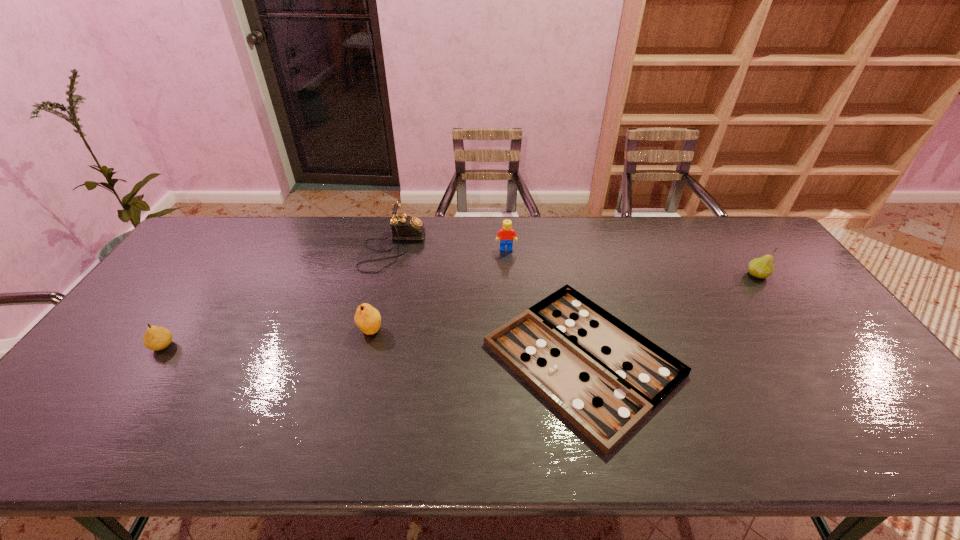
What are the coordinates of `telephone` in the screenshot? It's located at (404, 227).

Find the location of `Lego`. Lego is located at coordinates coord(506,234).

The image size is (960, 540). Identify the location of the rightmost pear. (763, 267).

The image size is (960, 540). What are the coordinates of `the farthest pear` in the screenshot? It's located at (763, 267).

The height and width of the screenshot is (540, 960). In order to click on the second pear from left to right in this screenshot , I will do `click(367, 318)`.

Where is `the leftmost pear`? This screenshot has width=960, height=540. the leftmost pear is located at coordinates (156, 338).

You are a GUI agent. You are given a task and a screenshot of the screen. Output one action in this format:
    pyautogui.click(x=<x>, y=<y>)
    Task: Click on the gameboard
    Image resolution: width=960 pixels, height=540 pixels.
    Given the screenshot: What is the action you would take?
    pyautogui.click(x=604, y=377)

What are the coordinates of `free location located on the dial of the telephone` in the screenshot? It's located at (508, 248).

Image resolution: width=960 pixels, height=540 pixels. Identify the location of vacant space positioned on the face of the Lego. (512, 332).

The image size is (960, 540). Find the location of `vacant space positioned on the back of the rightmost pear`. vacant space positioned on the back of the rightmost pear is located at coordinates (730, 237).